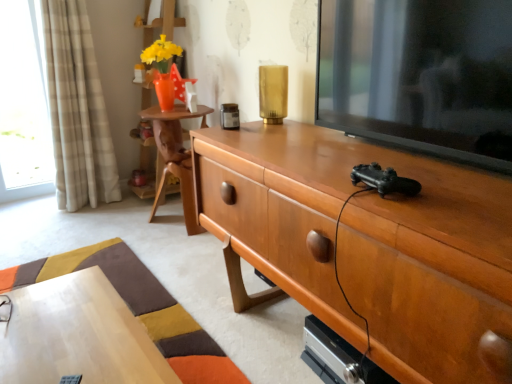
You are a GUI agent. You are given a task and a screenshot of the screen. Output one action in this format:
    pyautogui.click(x=<x>, y=<y>)
    Task: Click on the vacant region to the left of wooden cabinet at center
    
    Given the screenshot: What is the action you would take?
    pyautogui.click(x=185, y=309)